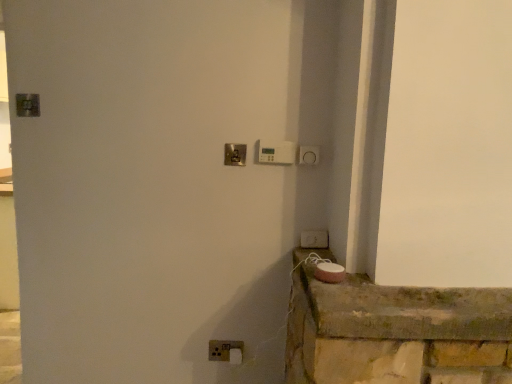
Question: From their relative heights in the image, would you say white plastic light switch at lower center, the 3th light switch in the top-to-bottom sequence, is taller or shorter than white plastic light switch at lower right, acting as the 2th light switch starting from the bottom?

Choices:
 (A) tall
 (B) short

Answer: (A)

Question: Considering the positions of white plastic light switch at lower center, the 1th light switch positioned from the left, and white plastic light switch at lower right, which appears as the 2th light switch when viewed from the top, in the image, is white plastic light switch at lower center, the 1th light switch positioned from the left, wider or thinner than white plastic light switch at lower right, which appears as the 2th light switch when viewed from the top,?

Choices:
 (A) thin
 (B) wide

Answer: (A)

Question: Estimate the real-world distances between objects in this image. Which object is closer to the white plastic thermostat at upper center, which ranks as the second light switch in right-to-left order?

Choices:
 (A) pink matte speaker at lower right
 (B) white plastic light switch at lower right, acting as the 2th light switch starting from the bottom
 (C) white plastic light switch at lower center, placed as the first light switch when sorted from bottom to top
 (D) polished brass door handle at center

Answer: (D)

Question: Which is farther from the pink matte speaker at lower right?

Choices:
 (A) white plastic light switch at lower right, acting as the 2th light switch starting from the bottom
 (B) white plastic thermostat at upper center, placed as the 2th light switch when sorted from left to right
 (C) polished brass door handle at center
 (D) white plastic light switch at lower center, the 3th light switch in the top-to-bottom sequence

Answer: (C)